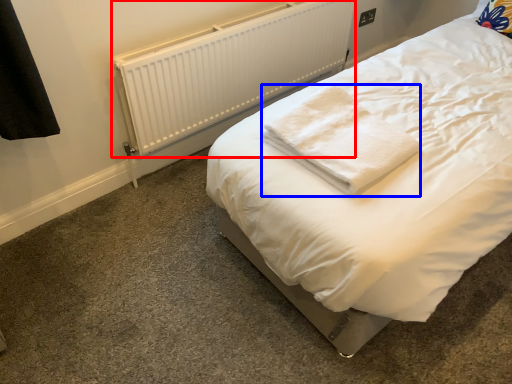
Question: Which object is closer to the camera taking this photo, radiator (highlighted by a red box) or cloth (highlighted by a blue box)?

Choices:
 (A) radiator
 (B) cloth

Answer: (B)